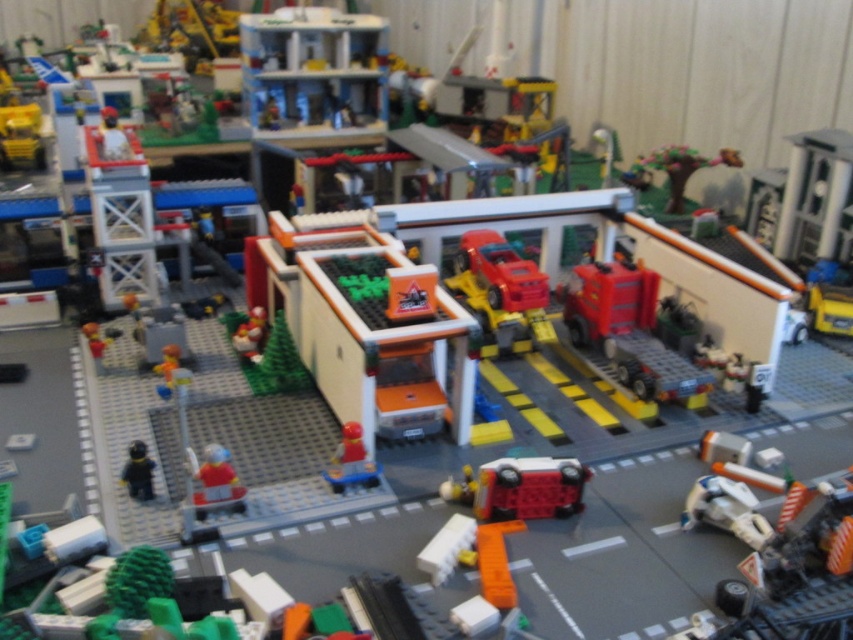
You are a drone operator trying to deliver a package to the orange matte truck at center in the Lego diorama. The drone can only hover at coordinates between 0.4 and 0.6 on both the x and y axes. Can the drone reach the truck?

The orange matte truck at center is located at coordinates point (367,324), which falls within the drone delivery area between 0.4 and 0.6 on both axes. Therefore, the drone can successfully reach the orange matte truck at center.

Looking at this image, you are a Lego figure trying to fit through a narrow gap between two buildings. You see the orange matte truck at center and the smooth red figure at center. Which object is wider and might block your path?

The orange matte truck at center is wider than the smooth red figure at center, so it might block your path more than the smooth red figure at center.